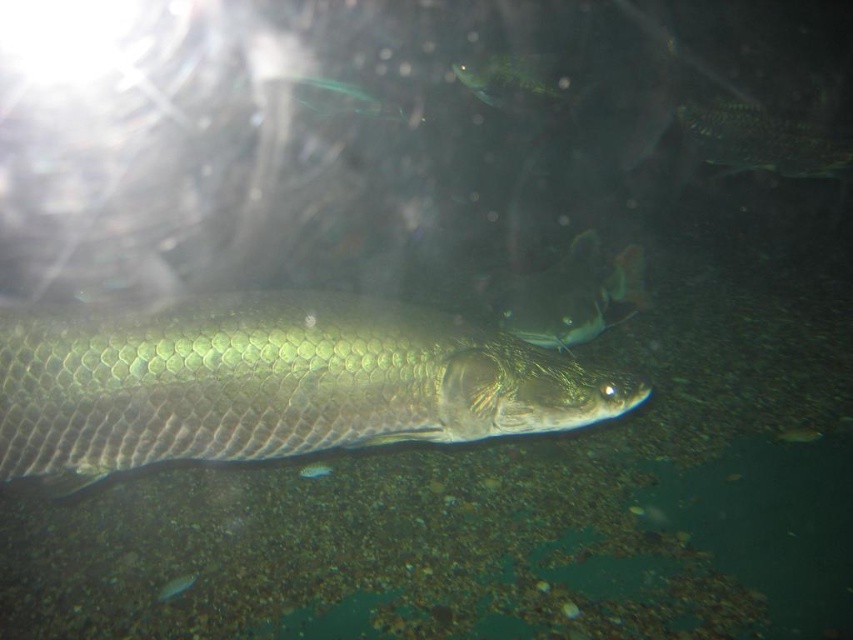
You are a marine biologist observing underwater life. You notice a point marked at coordinates (338, 97). What creature is located at this point?

The point at (338, 97) indicates a green shiny fish at upper center.

You are a marine biologist observing an underwater scene. You notice two fish, the shiny green fish at upper center and the shiny silver fish at lower left. Based on their positions, which fish do you think is closer to the surface of the water?

The shiny green fish at upper center is closer to the surface of the water because it is positioned higher in the image, which typically corresponds to being nearer to the water surface compared to the shiny silver fish at lower left.